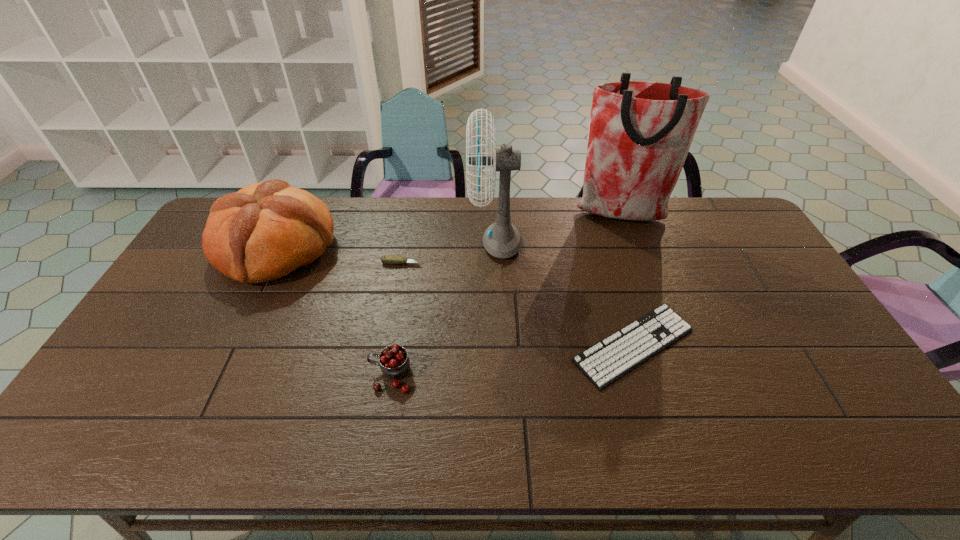
The image size is (960, 540). Identify the location of grocery bag. (640, 132).

You are a GUI agent. You are given a task and a screenshot of the screen. Output one action in this format:
    pyautogui.click(x=<x>, y=<y>)
    Task: Click on the third object from right to left
    The width and height of the screenshot is (960, 540).
    Given the screenshot: What is the action you would take?
    pyautogui.click(x=501, y=239)

Image resolution: width=960 pixels, height=540 pixels. In order to click on bread in this screenshot , I will do `click(266, 230)`.

I want to click on the fourth shortest object, so click(266, 230).

Identify the location of the fourth tallest object. (394, 362).

This screenshot has height=540, width=960. In order to click on pocketknife in this screenshot , I will do `click(386, 259)`.

You are a GUI agent. You are given a task and a screenshot of the screen. Output one action in this format:
    pyautogui.click(x=<x>, y=<y>)
    Task: Click on the computer keyboard
    Image resolution: width=960 pixels, height=540 pixels.
    Given the screenshot: What is the action you would take?
    pyautogui.click(x=605, y=362)

The height and width of the screenshot is (540, 960). I want to click on vacant space situated on the right of the grocery bag, so click(733, 216).

Where is `free location located on the front-facing side of the fourth object from left to right`? The height and width of the screenshot is (540, 960). free location located on the front-facing side of the fourth object from left to right is located at coordinates (405, 242).

This screenshot has height=540, width=960. Find the location of `vacant region located 0.280m on the front-facing side of the fourth object from left to right`. vacant region located 0.280m on the front-facing side of the fourth object from left to right is located at coordinates (388, 242).